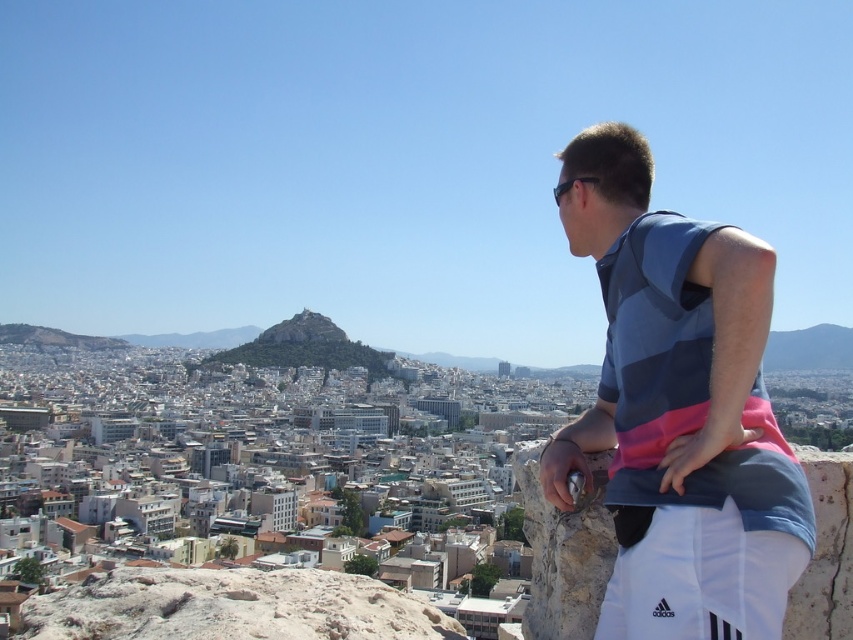
Which is more to the right, blue striped sleeveless shirt at right or smooth stone peak at center?

blue striped sleeveless shirt at right

How much distance is there between blue striped sleeveless shirt at right and smooth stone peak at center?

blue striped sleeveless shirt at right and smooth stone peak at center are 1516.94 feet apart.

Identify the location of blue striped sleeveless shirt at right. [679, 410].